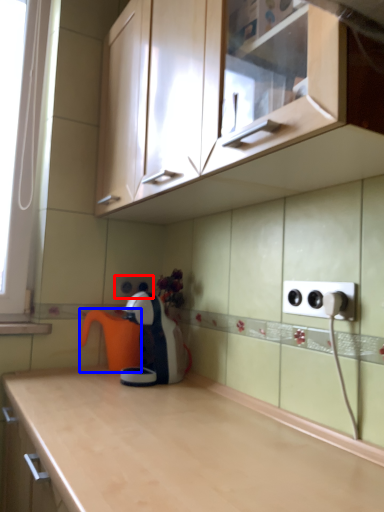
Question: Which object appears farthest to the camera in this image, electric outlet (highlighted by a red box) or coffeepot (highlighted by a blue box)?

Choices:
 (A) electric outlet
 (B) coffeepot

Answer: (A)